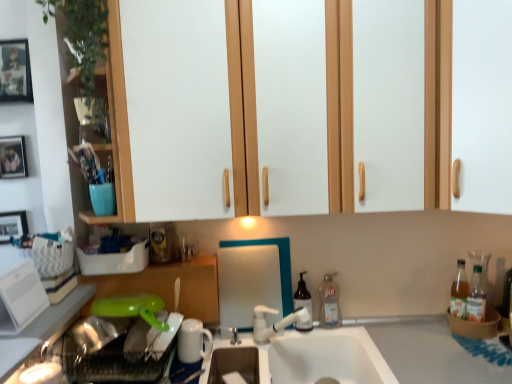
Question: Considering the relative positions of white matte cabinet door at upper right, acting as the 2th cabinetry starting from the bottom, and clear plastic bottle at sink right, the 2th bottle in the left-to-right sequence, in the image provided, is white matte cabinet door at upper right, acting as the 2th cabinetry starting from the bottom, to the left of clear plastic bottle at sink right, the 2th bottle in the left-to-right sequence, from the viewer's perspective?

Choices:
 (A) yes
 (B) no

Answer: (B)

Question: From a real-world perspective, is white matte cabinet door at upper right, marked as the 1th cabinetry in a top-to-bottom arrangement, physically above clear plastic bottle at sink right, the 2th bottle in the left-to-right sequence?

Choices:
 (A) no
 (B) yes

Answer: (B)

Question: Is white matte cabinet door at upper right, which is the first cabinetry from right to left, facing towards clear plastic bottle at sink right, placed as the 1th bottle when sorted from right to left?

Choices:
 (A) no
 (B) yes

Answer: (A)

Question: Can you confirm if white matte cabinet door at upper right, acting as the 2th cabinetry starting from the bottom, is positioned to the right of clear plastic bottle at sink right, placed as the 1th bottle when sorted from right to left?

Choices:
 (A) yes
 (B) no

Answer: (A)

Question: Is white matte cabinet door at upper right, marked as the 1th cabinetry in a top-to-bottom arrangement, not close to clear plastic bottle at sink right, the 2th bottle in the left-to-right sequence?

Choices:
 (A) no
 (B) yes

Answer: (A)

Question: Is white matte cabinet door at upper right, arranged as the second cabinetry when viewed from the left, closer to camera compared to clear plastic bottle at sink right, placed as the 1th bottle when sorted from right to left?

Choices:
 (A) yes
 (B) no

Answer: (A)

Question: Is the position of white plastic tap at center less distant than that of white glossy refrigerator at left, positioned as the first appliance in front-to-back order?

Choices:
 (A) yes
 (B) no

Answer: (B)

Question: Can you see white plastic tap at center touching white glossy refrigerator at left, arranged as the first appliance when viewed from the top?

Choices:
 (A) no
 (B) yes

Answer: (A)

Question: Can you confirm if white plastic tap at center is taller than white glossy refrigerator at left, acting as the 2th appliance starting from the right?

Choices:
 (A) no
 (B) yes

Answer: (A)

Question: Considering the relative sizes of white plastic tap at center and white glossy refrigerator at left, arranged as the 1th appliance when viewed from the left, in the image provided, is white plastic tap at center shorter than white glossy refrigerator at left, arranged as the 1th appliance when viewed from the left,?

Choices:
 (A) no
 (B) yes

Answer: (B)

Question: Considering the relative positions of white plastic tap at center and white glossy refrigerator at left, the 2th appliance from the bottom, in the image provided, is white plastic tap at center to the right of white glossy refrigerator at left, the 2th appliance from the bottom, from the viewer's perspective?

Choices:
 (A) yes
 (B) no

Answer: (A)

Question: Is white plastic tap at center outside of white glossy refrigerator at left, positioned as the first appliance in front-to-back order?

Choices:
 (A) yes
 (B) no

Answer: (A)

Question: Is translucent plastic soap dispenser at center, which is counted as the second bottle, starting from the right, wider than clear plastic bottle at sink right, placed as the 1th bottle when sorted from right to left?

Choices:
 (A) yes
 (B) no

Answer: (A)